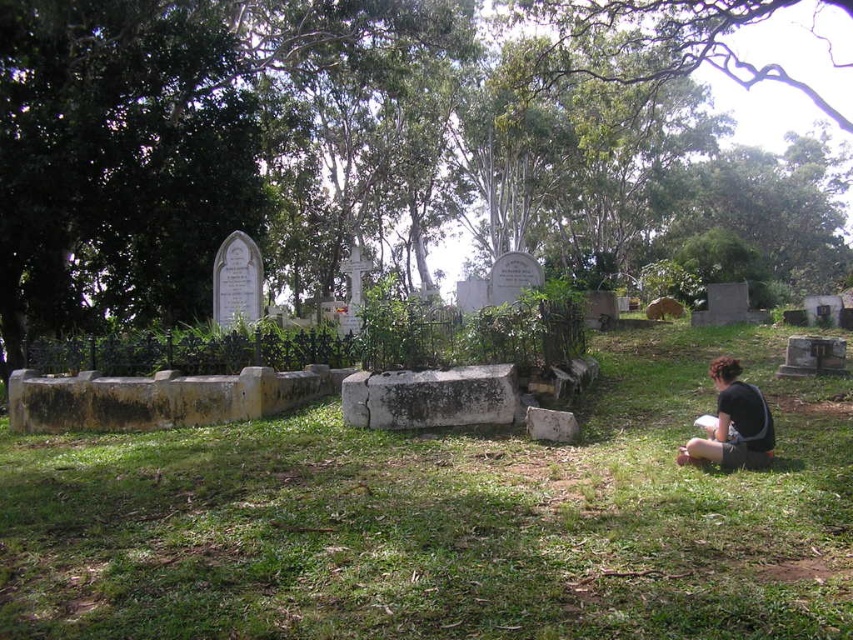
Question: Which point is closer to the camera taking this photo?

Choices:
 (A) (723, 449)
 (B) (695, 544)
 (C) (317, 102)

Answer: (B)

Question: Among these objects, which one is nearest to the camera?

Choices:
 (A) green grassy at center
 (B) black fabric squat at lower right

Answer: (A)

Question: In this image, where is green leafy tree at center located relative to green grassy at center?

Choices:
 (A) below
 (B) above

Answer: (B)

Question: Which object is the farthest from the green leafy tree at center?

Choices:
 (A) black fabric squat at lower right
 (B) green grassy at center

Answer: (A)

Question: Does green leafy tree at center appear under green grassy at center?

Choices:
 (A) yes
 (B) no

Answer: (B)

Question: Can you confirm if green grassy at center is positioned below black fabric squat at lower right?

Choices:
 (A) yes
 (B) no

Answer: (A)